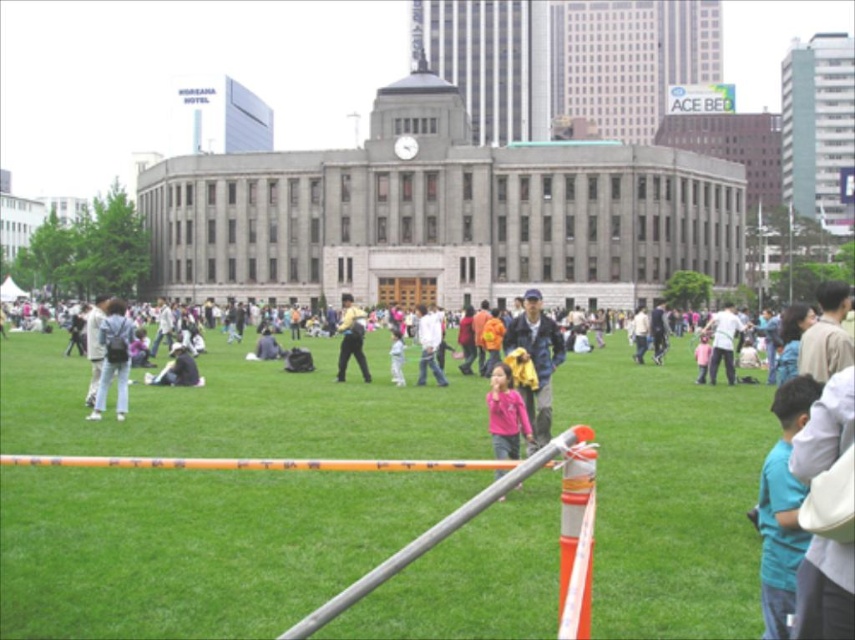
Question: Is white matte jacket at center-right closer to the viewer compared to yellow fabric backpack at center?

Choices:
 (A) no
 (B) yes

Answer: (B)

Question: Based on their relative distances, which object is nearer to the blue denim jacket at center?

Choices:
 (A) orange plastic rail at center
 (B) white matte jacket at center-right

Answer: (A)

Question: Which point is closer to the camera taking this photo?

Choices:
 (A) (540, 333)
 (B) (391, 349)
 (C) (275, 339)

Answer: (A)

Question: Does blue cotton shirt at right appear over light blue denim jacket at center?

Choices:
 (A) yes
 (B) no

Answer: (B)

Question: Does orange plastic rail at center come behind dark gray fabric jacket at center?

Choices:
 (A) no
 (B) yes

Answer: (A)

Question: Which of these objects is positioned closest to the blue cotton shirt at right?

Choices:
 (A) light blue denim jacket at center
 (B) blue denim jacket at center

Answer: (B)